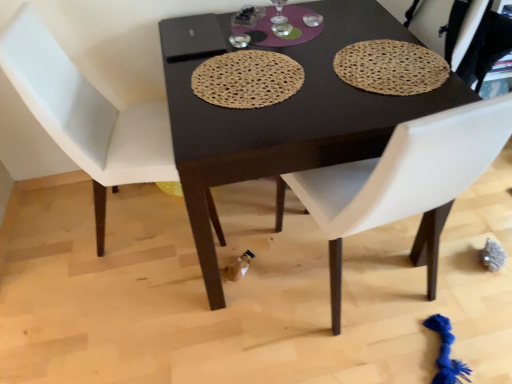
This screenshot has width=512, height=384. I want to click on vacant space positioned to the left of white leather chair at center, the 1th chair in the right-to-left sequence, so click(232, 322).